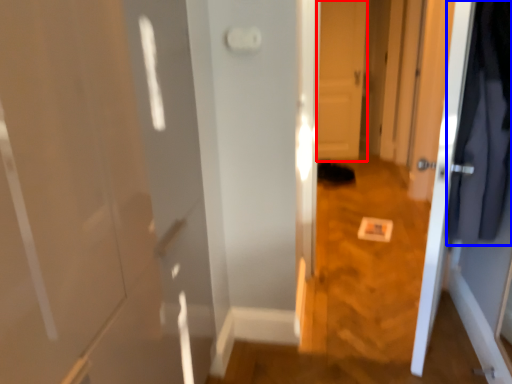
Question: Which of the following is the closest to the observer, door (highlighted by a red box) or clothing (highlighted by a blue box)?

Choices:
 (A) door
 (B) clothing

Answer: (B)